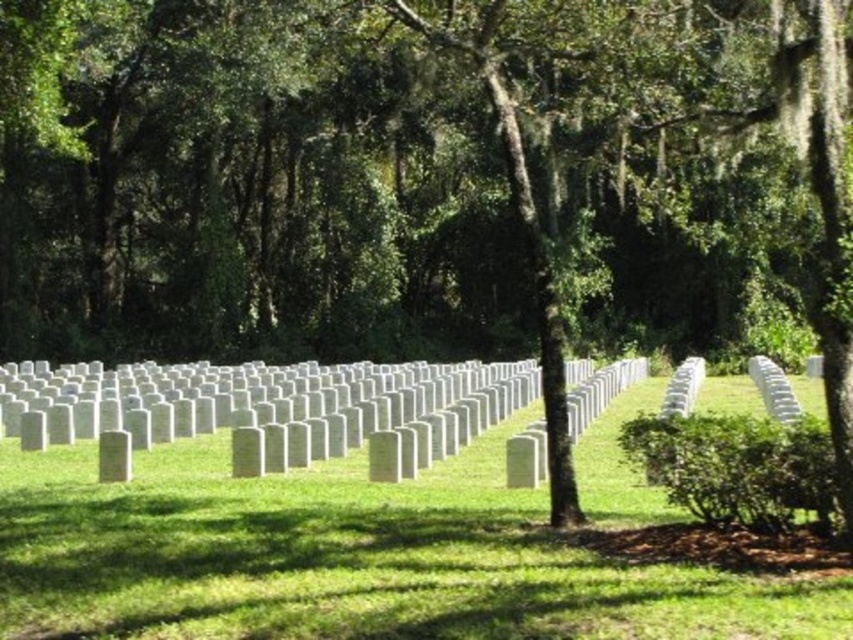
You are a gardener planning to mow the green grass at center and the white marble headstones at center. Which one should you mow first based on their position?

The green grass at center is located below the white marble headstones at center, so you should mow the green grass at center first before the headstones since it is underneath them.

You are standing at the entrance of the cemetery and want to walk towards the green grass at center. Based on the coordinates provided, in which direction should you head?

You should head towards the coordinates point at (x=345, y=556) to reach the green grass at center.

You are a groundskeeper planning to mow the green grass at center. There are white marble headstones at center nearby. What is the minimum width your lawnmower needs to be to avoid hitting the headstones?

The distance between the green grass at center and the white marble headstones at center is 15.14 feet. To avoid hitting the headstones, the lawnmower must be narrower than this distance. Therefore, the minimum width should be less than 15.14 feet.